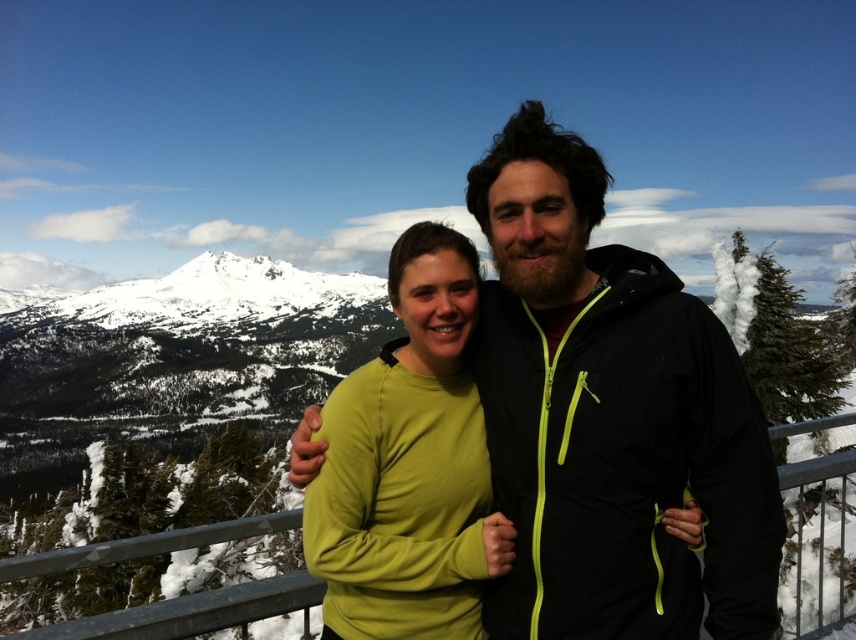
You are a photographer trying to capture a portrait of the two people in the image. You notice the matte black jacket at center and the green matte sweater at center. Which clothing item is positioned higher on the person wearing it compared to the other?

The matte black jacket at center is above the green matte sweater at center, so the matte black jacket at center is positioned higher on the person wearing it compared to the green matte sweater at center.

You are a photographer positioned 10 meters away from the two people in the scene. You want to take a photo of the matte black jacket at center and the green matte sweater at center. Can you fit both into your camera frame if your camera has a maximum field of view that can capture objects up to 10 meters apart?

The matte black jacket at center is 11.17 meters from the green matte sweater at center, which exceeds the camera field of view limit of 10 meters. Therefore, both cannot be captured in a single frame.

You are a photographer standing at the camera position. You want to take a closeup shot of the matte black jacket at center. Based on the scene description, can you estimate whether the jacket is within your camera lens focal length range of 50 meters?

The matte black jacket at center is 66.59 meters away from camera. Since the camera lens focal length can only capture up to 50 meters, the jacket is outside the focal range and cannot be captured in a closeup shot.